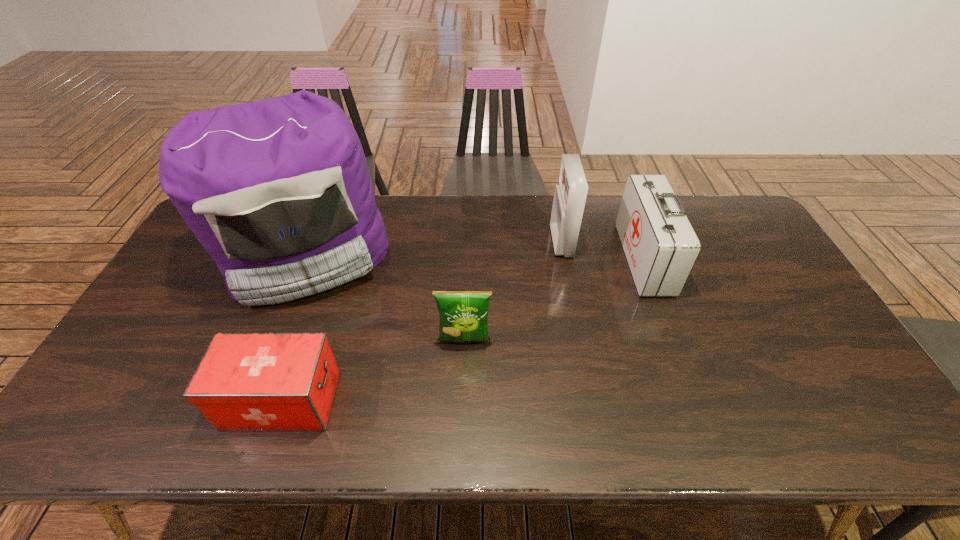
At what (x,y) coordinates should I click in order to perform the action: click on free space that satisfies the following two spatial constraints: 1. on the front-facing side of the third object from right to left; 2. on the handle side of the leftmost first-aid kit. Please return your answer as a coordinate pair (x, y). Image resolution: width=960 pixels, height=540 pixels. Looking at the image, I should click on (463, 400).

Find the location of a particular element. This screenshot has height=540, width=960. vacant space that satisfies the following two spatial constraints: 1. on the front-facing side of the crisp (potato chip); 2. on the handle side of the nearest first-aid kit is located at coordinates (463, 400).

Find the location of a particular element. This screenshot has height=540, width=960. vacant region that satisfies the following two spatial constraints: 1. on the front-facing side of the fourth farthest object; 2. on the handle side of the nearest object is located at coordinates (463, 400).

Locate an element on the screen. This screenshot has height=540, width=960. free space that satisfies the following two spatial constraints: 1. on the front-facing side of the tallest first-aid kit; 2. on the front-facing side of the crisp (potato chip) is located at coordinates (580, 341).

You are a GUI agent. You are given a task and a screenshot of the screen. Output one action in this format:
    pyautogui.click(x=<x>, y=<y>)
    Task: Click on the vacant point that satisfies the following two spatial constraints: 1. on the front-facing side of the rightmost first-aid kit; 2. on the front-facing side of the fourth farthest object
    Image resolution: width=960 pixels, height=540 pixels.
    Given the screenshot: What is the action you would take?
    pyautogui.click(x=675, y=341)

Locate an element on the screen. vacant area that satisfies the following two spatial constraints: 1. on the front-facing side of the fourth object from left to right; 2. on the front-facing side of the third object from right to left is located at coordinates (580, 341).

You are a GUI agent. You are given a task and a screenshot of the screen. Output one action in this format:
    pyautogui.click(x=<x>, y=<y>)
    Task: Click on the vacant position in the image that satisfies the following two spatial constraints: 1. on the front-facing side of the rightmost object; 2. on the front-facing side of the third object from left to right
    The image size is (960, 540).
    Given the screenshot: What is the action you would take?
    pyautogui.click(x=675, y=341)

The height and width of the screenshot is (540, 960). Identify the location of blank space that satisfies the following two spatial constraints: 1. on the front-facing side of the third object from right to left; 2. on the handle side of the nearest first-aid kit. (463, 400).